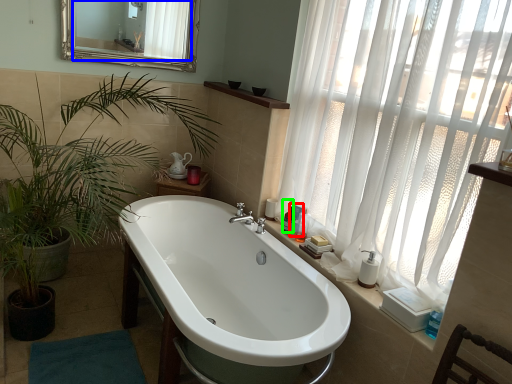
Question: Which object is positioned farthest from toiletry (highlighted by a red box)? Select from mirror (highlighted by a blue box) and toiletry (highlighted by a green box).

Choices:
 (A) mirror
 (B) toiletry

Answer: (A)